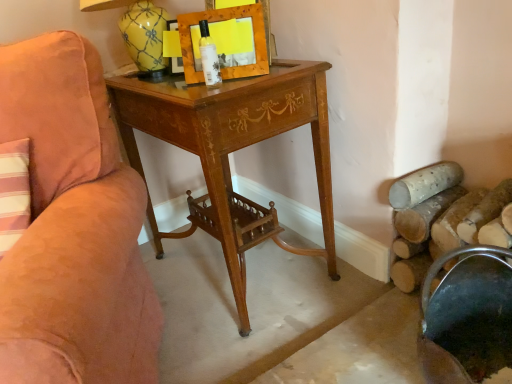
Locate an element on the screen. free space in front of wooden picture frame at upper center is located at coordinates (225, 91).